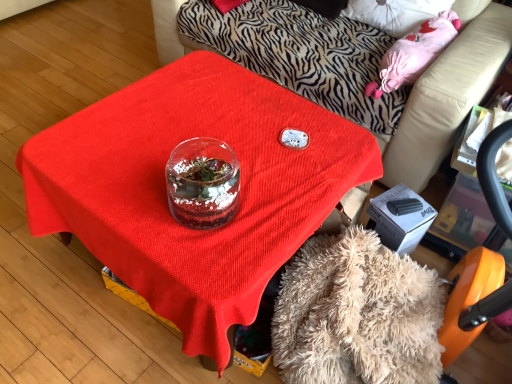
Locate an element on the screen. This screenshot has height=384, width=512. vacant point above transparent glass terrarium at center (from a real-world perspective) is located at coordinates (186, 158).